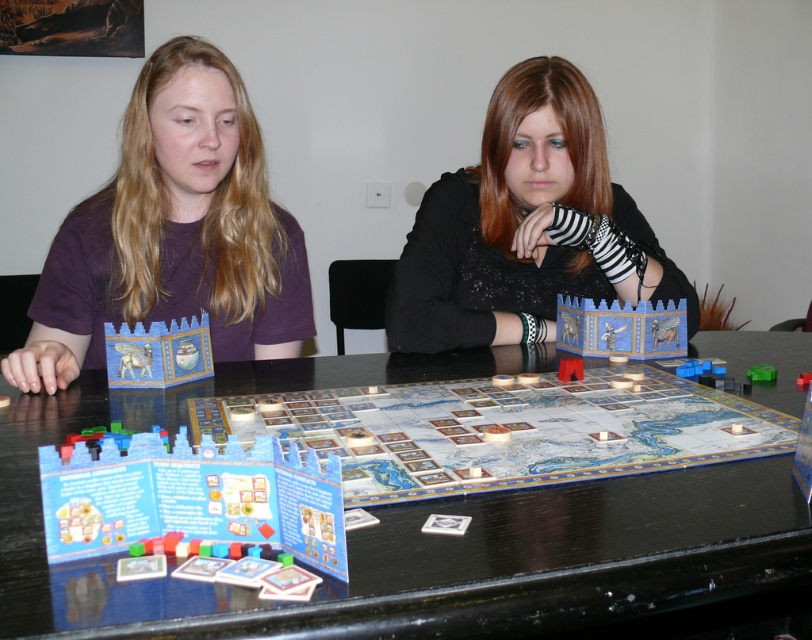
You are standing in the room where the board game is being played. You need to locate the black textured sweater at center. According to the coordinates provided, where exactly is it positioned?

The black textured sweater at center is located at point (x=525, y=227).

You are a game piece that needs to move from the edge of the table to the blue painted wood castle at center. However, there is a black textured sweater at center in the way. Can you reach the castle without moving the sweater?

The black textured sweater at center is positioned over blue painted wood castle at center, so the castle is underneath the sweater. You cannot reach the castle without moving the sweater.

You are a photographer setting up a shot of the scene. You want to ensure both the black textured sweater at center and the blue cardboard instruction booklets at center are clearly visible. Which object should you focus on first to ensure depth of field captures both?

The black textured sweater at center is above the blue cardboard instruction booklets at center. Since the sweater is closer to the camera, focusing on it first will ensure the booklets, being further back, remain in focus as well due to depth of field.